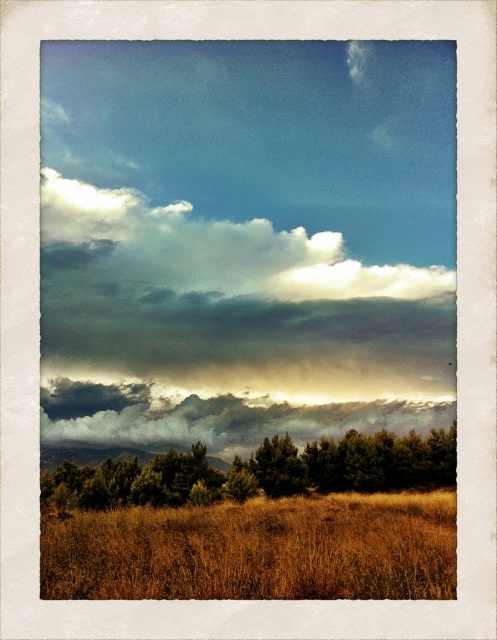
Who is lower down, green textured trees at lower center or cloudy textured sky at center?

green textured trees at lower center is below.

Which is more to the left, green textured trees at lower center or cloudy textured sky at center?

From the viewer's perspective, green textured trees at lower center appears more on the left side.

The height and width of the screenshot is (640, 497). Find the location of `green textured trees at lower center`. green textured trees at lower center is located at coordinates (259, 472).

Where is `green textured trees at lower center`? The width and height of the screenshot is (497, 640). green textured trees at lower center is located at coordinates (259, 472).

Who is more distant from viewer, (327, 541) or (412, 449)?

Point (412, 449)

Which is more to the right, brown dry grass at lower center or green textured trees at lower center?

Positioned to the right is brown dry grass at lower center.

Who is more forward, (429, 524) or (84, 481)?

Point (429, 524) is in front.

Locate an element on the screen. This screenshot has height=640, width=497. brown dry grass at lower center is located at coordinates (256, 548).

Between point (344, 506) and point (425, 408), which one is positioned in front?

Point (344, 506) is more forward.

Between point (154, 556) and point (158, 417), which one is positioned behind?

The point (158, 417) is more distant.

Between point (361, 563) and point (90, 410), which one is positioned in front?

Point (361, 563) is more forward.

Identify the location of brown dry grass at lower center. (256, 548).